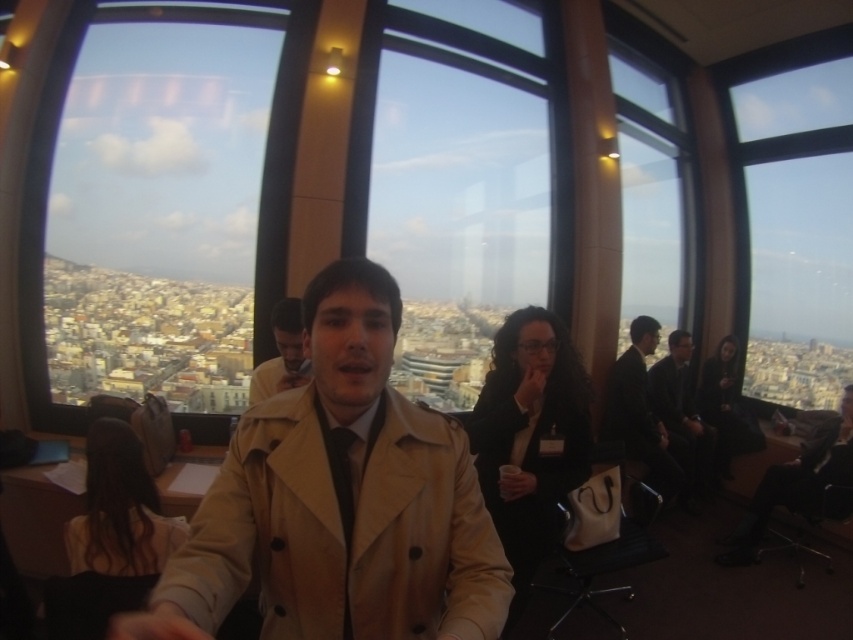
Between point (766, 180) and point (688, 342), which one is positioned behind?

The point (766, 180) is behind.

Who is more forward, (825, 172) or (706, 465)?

Point (706, 465) is more forward.

Is point (799, 145) positioned behind point (709, 433)?

Yes, point (799, 145) is farther from viewer.

Locate an element on the screen. The height and width of the screenshot is (640, 853). transparent glass window at upper right is located at coordinates (795, 212).

Does transparent glass window at upper left appear on the left side of matte beige coat at center?

Indeed, transparent glass window at upper left is positioned on the left side of matte beige coat at center.

Does transparent glass window at upper left lie in front of matte beige coat at center?

Yes, it is.

What are the coordinates of `transparent glass window at upper left` in the screenshot? It's located at (144, 211).

Locate an element on the screen. transparent glass window at upper left is located at coordinates (144, 211).

Is transparent glass window at upper right positioned behind matte beige coat at center?

No, it is not.

Who is shorter, transparent glass window at upper right or matte beige coat at center?

With less height is matte beige coat at center.

Which is in front, point (824, 152) or point (259, 388)?

Point (259, 388) is more forward.

Locate an element on the screen. transparent glass window at upper right is located at coordinates (795, 212).